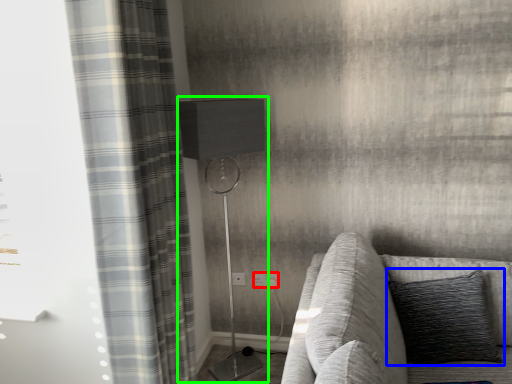
Question: Which object is the farthest from electric outlet (highlighted by a red box)? Choose among these: pillow (highlighted by a blue box) or table lamp (highlighted by a green box).

Choices:
 (A) pillow
 (B) table lamp

Answer: (A)